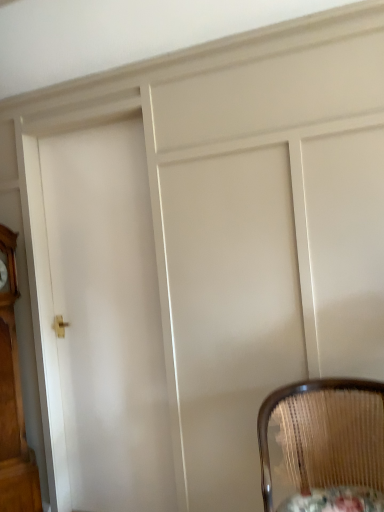
Question: Is white glossy door at center placed right next to woven wood chair at lower right?

Choices:
 (A) yes
 (B) no

Answer: (B)

Question: Does white glossy door at center have a lesser height compared to woven wood chair at lower right?

Choices:
 (A) yes
 (B) no

Answer: (B)

Question: From a real-world perspective, is white glossy door at center located beneath woven wood chair at lower right?

Choices:
 (A) no
 (B) yes

Answer: (A)

Question: Is white glossy door at center closer to camera compared to woven wood chair at lower right?

Choices:
 (A) no
 (B) yes

Answer: (A)

Question: Is white glossy door at center thinner than woven wood chair at lower right?

Choices:
 (A) no
 (B) yes

Answer: (B)

Question: From the image's perspective, is white glossy door at center over woven wood chair at lower right?

Choices:
 (A) yes
 (B) no

Answer: (A)

Question: Does woven wood chair at lower right have a greater height compared to wooden textured round table at lower right?

Choices:
 (A) yes
 (B) no

Answer: (A)

Question: Is woven wood chair at lower right positioned behind wooden textured round table at lower right?

Choices:
 (A) yes
 (B) no

Answer: (B)

Question: Considering the relative positions of woven wood chair at lower right and wooden textured round table at lower right in the image provided, is woven wood chair at lower right in front of wooden textured round table at lower right?

Choices:
 (A) no
 (B) yes

Answer: (B)

Question: From a real-world perspective, is woven wood chair at lower right beneath wooden textured round table at lower right?

Choices:
 (A) no
 (B) yes

Answer: (A)

Question: Is woven wood chair at lower right bigger than wooden textured round table at lower right?

Choices:
 (A) yes
 (B) no

Answer: (A)

Question: Considering the relative sizes of woven wood chair at lower right and wooden textured round table at lower right in the image provided, is woven wood chair at lower right smaller than wooden textured round table at lower right?

Choices:
 (A) yes
 (B) no

Answer: (B)

Question: Can wooden textured round table at lower right be found inside wooden grandfather clock at left?

Choices:
 (A) yes
 (B) no

Answer: (B)